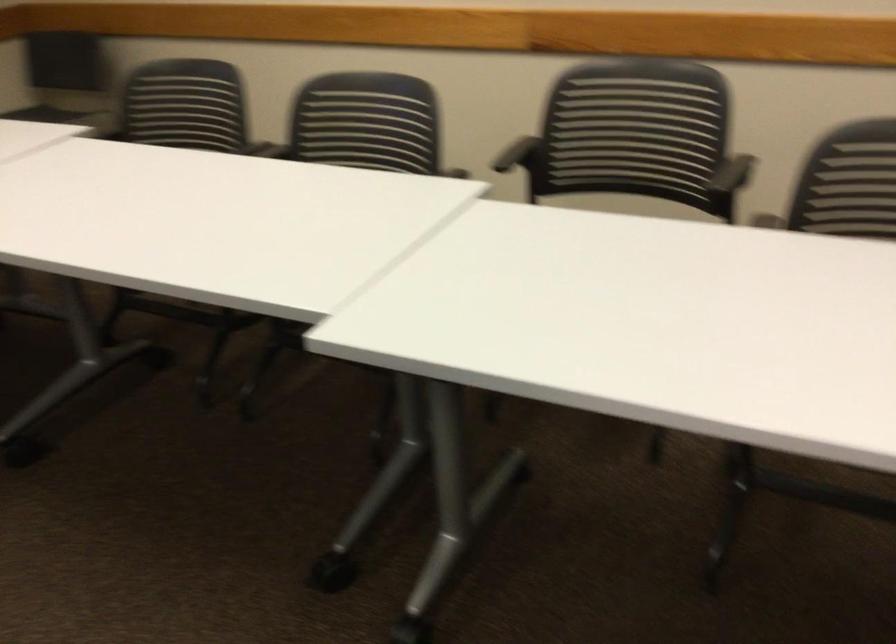
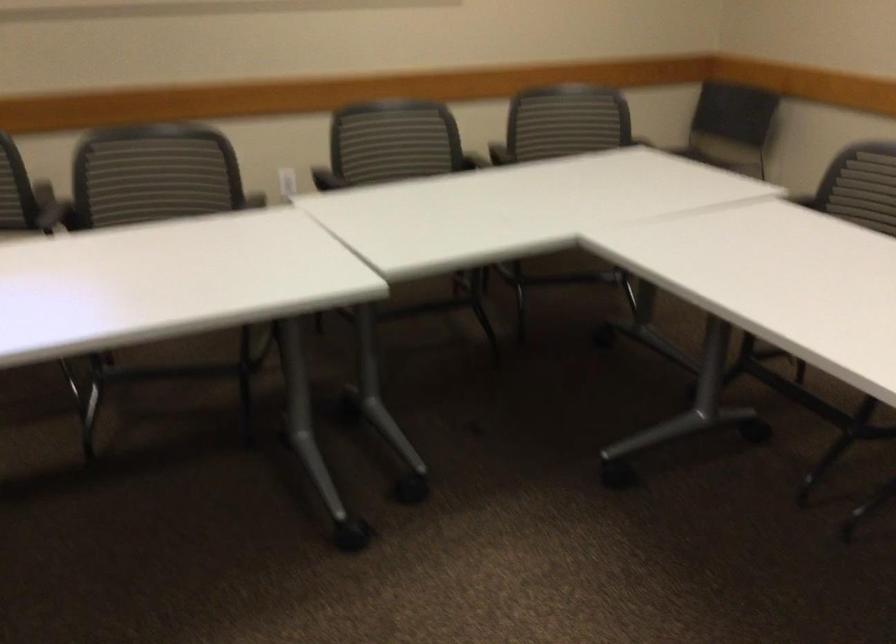
Locate, in the second image, the point that corresponds to point 165,109 in the first image.

(866, 185)